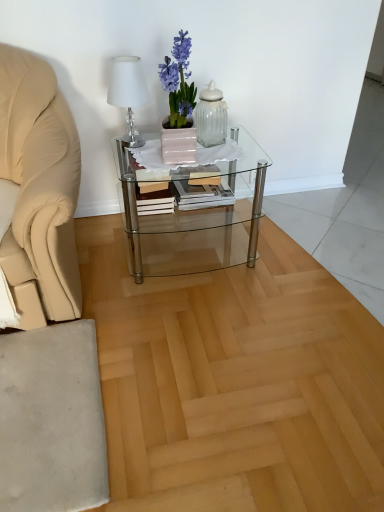
Locate an element on the screen. Image resolution: width=384 pixels, height=512 pixels. clear glass jar at center is located at coordinates (211, 116).

Find the location of a particular element. Image resolution: width=384 pixels, height=512 pixels. clear glass coffee table at center is located at coordinates (191, 207).

Where is `wooden book at center`? Image resolution: width=384 pixels, height=512 pixels. wooden book at center is located at coordinates coord(182,190).

What is the approximate width of white fabric lampshade at upper left?

7.26 inches.

Locate an element on the screen. This screenshot has height=512, width=384. clear glass jar at center is located at coordinates (211, 116).

Considering the positions of objects white fabric lampshade at upper left and clear glass coffee table at center in the image provided, who is behind, white fabric lampshade at upper left or clear glass coffee table at center?

clear glass coffee table at center is behind.

Is white fabric lampshade at upper left touching clear glass coffee table at center?

No, white fabric lampshade at upper left is not in contact with clear glass coffee table at center.

Is white fabric lampshade at upper left aimed at clear glass coffee table at center?

No, white fabric lampshade at upper left is not aimed at clear glass coffee table at center.

This screenshot has height=512, width=384. In order to click on glass vase behind the clear glass coffee table at center in this screenshot , I will do `click(211, 116)`.

Is clear glass coffee table at center surrounded by clear glass jar at center?

No, clear glass jar at center does not contain clear glass coffee table at center.

Considering the relative positions of clear glass jar at center and clear glass coffee table at center in the image provided, is clear glass jar at center in front of clear glass coffee table at center?

That is False.

Which of these two, clear glass jar at center or clear glass coffee table at center, is wider?

Wider between the two is clear glass coffee table at center.

In terms of size, does clear glass coffee table at center appear bigger or smaller than wooden book at center?

In the image, clear glass coffee table at center appears to be larger than wooden book at center.

Considering the positions of point (244, 135) and point (166, 207), is point (244, 135) closer or farther from the camera than point (166, 207)?

Point (244, 135) appears to be farther away from the viewer than point (166, 207).

From a real-world perspective, is clear glass coffee table at center located higher than wooden book at center?

Incorrect, from a real-world perspective, clear glass coffee table at center is lower than wooden book at center.

The height and width of the screenshot is (512, 384). Find the location of `book above the clear glass coffee table at center (from a real-world perspective)`. book above the clear glass coffee table at center (from a real-world perspective) is located at coordinates (182, 190).

Choose the correct answer: Is clear glass coffee table at center inside clear glass jar at center or outside it?

clear glass coffee table at center cannot be found inside clear glass jar at center.

From the image's perspective, is clear glass coffee table at center located beneath clear glass jar at center?

Indeed, from the image's perspective, clear glass coffee table at center is shown beneath clear glass jar at center.

Looking at this image, relative to clear glass jar at center, is clear glass coffee table at center in front or behind?

Visually, clear glass coffee table at center is located in front of clear glass jar at center.

Based on the photo, in terms of size, does wooden book at center appear bigger or smaller than clear glass jar at center?

wooden book at center is bigger than clear glass jar at center.

Is point (177, 193) behind point (216, 117)?

Yes, point (177, 193) is behind point (216, 117).

Considering the sizes of objects wooden book at center and clear glass jar at center in the image provided, who is taller, wooden book at center or clear glass jar at center?

With more height is clear glass jar at center.

What's the angular difference between wooden book at center and clear glass jar at center's facing directions?

They differ by 15.6 degrees in their facing directions.

What's the angular difference between clear glass jar at center and white fabric lampshade at upper left's facing directions?

The angular difference between clear glass jar at center and white fabric lampshade at upper left is 13.1 degrees.

Considering the positions of objects clear glass jar at center and white fabric lampshade at upper left in the image provided, who is more to the right, clear glass jar at center or white fabric lampshade at upper left?

Positioned to the right is clear glass jar at center.

From the image's perspective, does clear glass jar at center appear lower than white fabric lampshade at upper left?

Yes.

From a real-world perspective, is clear glass jar at center on white fabric lampshade at upper left?

No, from a real-world perspective, clear glass jar at center is not on top of white fabric lampshade at upper left.

Is clear glass jar at center facing away from wooden book at center?

No, wooden book at center is not at the back of clear glass jar at center.

Which of these two, clear glass jar at center or wooden book at center, is bigger?

wooden book at center.

Looking at this image, which point is more forward, (226, 121) or (151, 201)?

Positioned in front is point (151, 201).

At what (x,y) coordinates should I click in order to perform the action: click on table lamp on the left of clear glass coffee table at center. Please return your answer as a coordinate pair (x, y). The height and width of the screenshot is (512, 384). Looking at the image, I should click on (128, 91).

The width and height of the screenshot is (384, 512). In order to click on glass vase lying on the right of clear glass coffee table at center in this screenshot , I will do tap(211, 116).

Considering their positions, is clear glass jar at center positioned closer to wooden book at center than white fabric lampshade at upper left?

Based on the image, clear glass jar at center appears to be nearer to wooden book at center.

Estimate the real-world distances between objects in this image. Which object is closer to clear glass coffee table at center, clear glass jar at center or white fabric lampshade at upper left?

Based on the image, clear glass jar at center appears to be nearer to clear glass coffee table at center.

Estimate the real-world distances between objects in this image. Which object is further from white fabric lampshade at upper left, clear glass coffee table at center or clear glass jar at center?

clear glass coffee table at center is positioned further to the anchor white fabric lampshade at upper left.

Considering their positions, is clear glass coffee table at center positioned closer to white fabric lampshade at upper left than wooden book at center?

Among the two, wooden book at center is located nearer to white fabric lampshade at upper left.

Which object lies further to the anchor point wooden book at center, white fabric lampshade at upper left or clear glass jar at center?

The object further to wooden book at center is white fabric lampshade at upper left.

Based on their spatial positions, is white fabric lampshade at upper left or clear glass coffee table at center further from clear glass jar at center?

clear glass coffee table at center is positioned further to the anchor clear glass jar at center.

Considering their positions, is clear glass jar at center positioned closer to white fabric lampshade at upper left than wooden book at center?

Among the two, wooden book at center is located nearer to white fabric lampshade at upper left.

Which object lies nearer to the anchor point clear glass jar at center, clear glass coffee table at center or white fabric lampshade at upper left?

Among the two, white fabric lampshade at upper left is located nearer to clear glass jar at center.

I want to click on glass vase between white fabric lampshade at upper left and clear glass coffee table at center in the vertical direction, so click(211, 116).

This screenshot has height=512, width=384. In order to click on book between clear glass jar at center and clear glass coffee table at center from top to bottom in this screenshot , I will do `click(182, 190)`.

Locate an element on the screen. book between white fabric lampshade at upper left and clear glass coffee table at center in the up-down direction is located at coordinates (182, 190).

You are a GUI agent. You are given a task and a screenshot of the screen. Output one action in this format:
    pyautogui.click(x=<x>, y=<y>)
    Task: Click on the book between white fabric lampshade at upper left and clear glass jar at center in the horizontal direction
    The width and height of the screenshot is (384, 512).
    Given the screenshot: What is the action you would take?
    pyautogui.click(x=182, y=190)